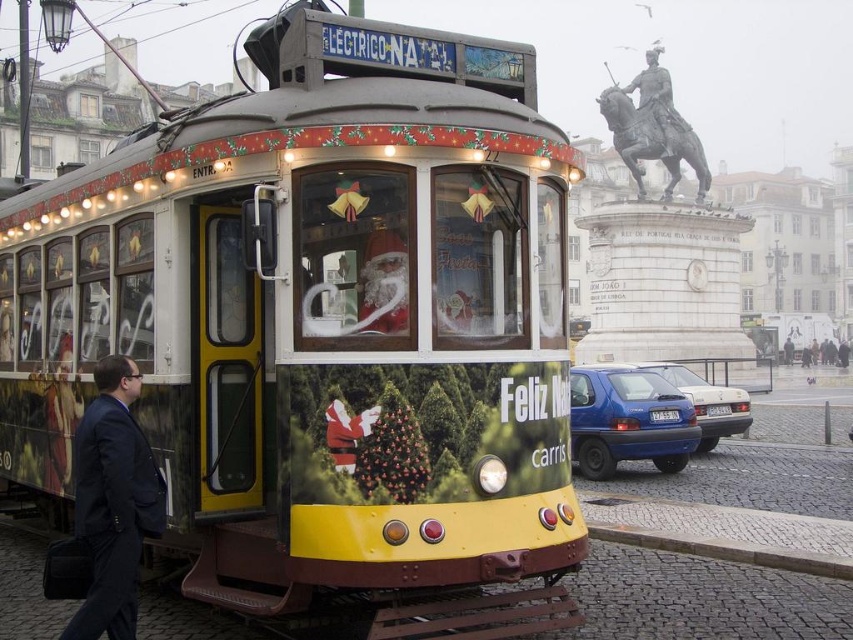
Question: Can you confirm if dark blue suit at left is positioned below red velvet santa at center?

Choices:
 (A) yes
 (B) no

Answer: (A)

Question: Is dark blue suit at left positioned at the back of red velvet santa at center?

Choices:
 (A) no
 (B) yes

Answer: (A)

Question: Which of these objects is positioned closest to the dark blue suit at left?

Choices:
 (A) bronze statue of man on horse at upper center
 (B) red velvet santa at center

Answer: (B)

Question: Which point appears closest to the camera in this image?

Choices:
 (A) (660, 154)
 (B) (349, 461)
 (C) (77, 500)

Answer: (C)

Question: Which of the following is the farthest from the observer?

Choices:
 (A) (636, 77)
 (B) (112, 452)
 (C) (352, 449)

Answer: (A)

Question: Can you confirm if bronze statue of man on horse at upper center is positioned to the right of red velvet santa at center?

Choices:
 (A) yes
 (B) no

Answer: (A)